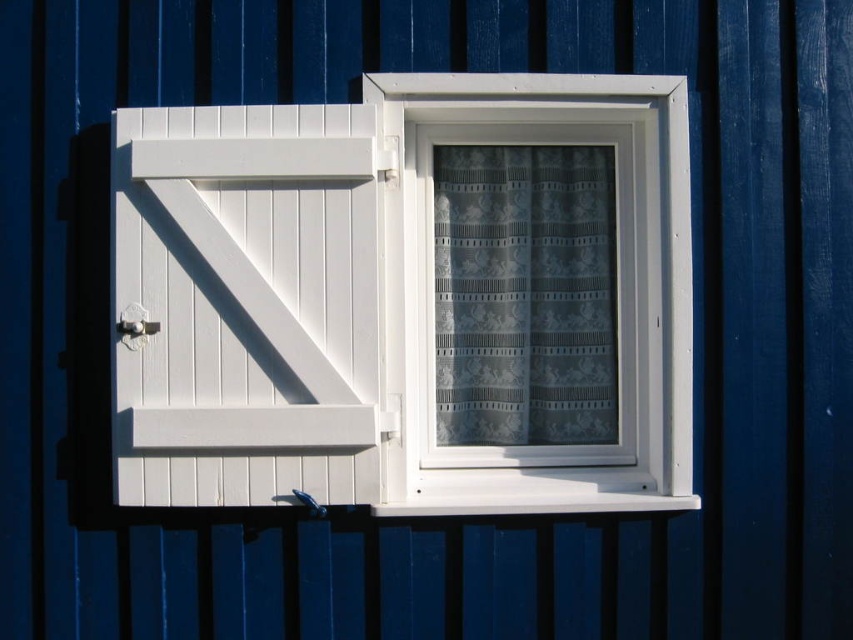
You are standing in a room with a blue wooden wall and a window with a white shutter on the left. There is a point marked at coordinates (247, 305). What object is located at this point?

The point at (247, 305) indicates the white wooden barn door at left.